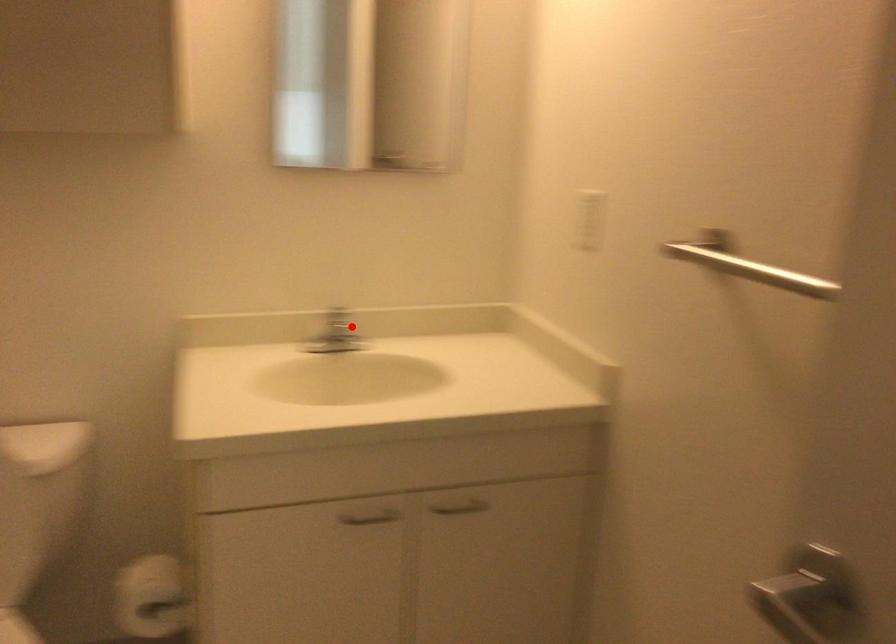
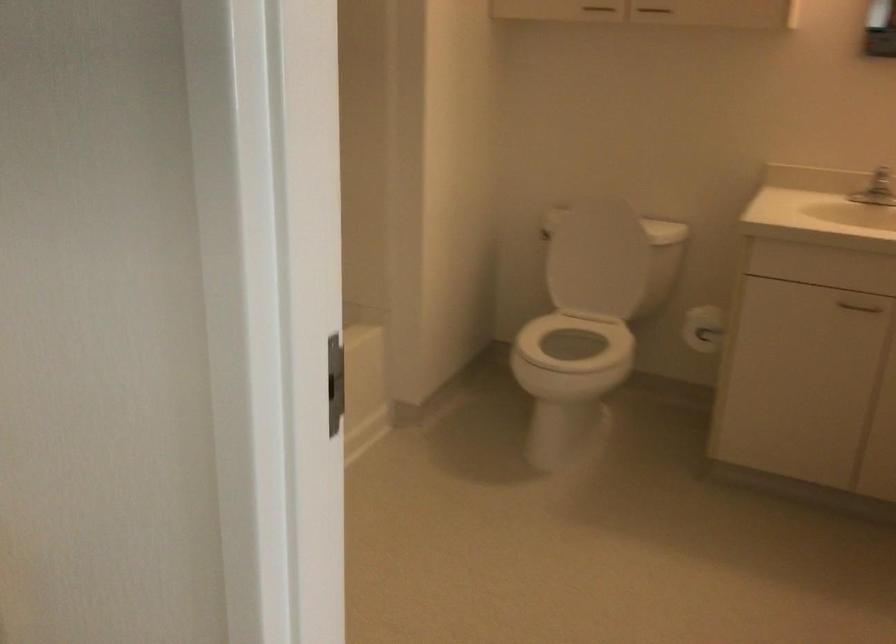
Question: I am providing you with two images of the same scene from different viewpoints. In image1, a red point is highlighted. Considering the same 3D point in image2, which of the following is correct?

Choices:
 (A) It is closer
 (B) It is farther

Answer: (B)